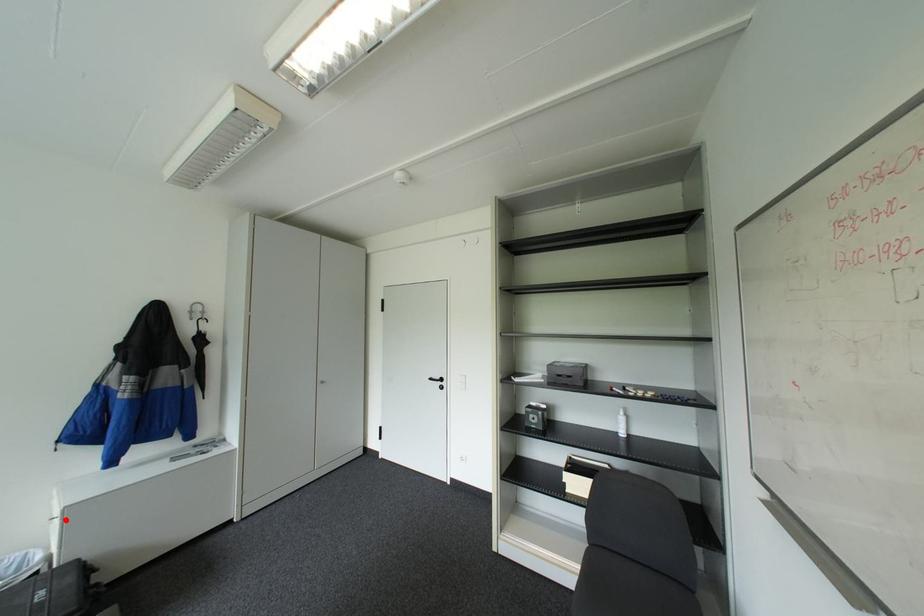
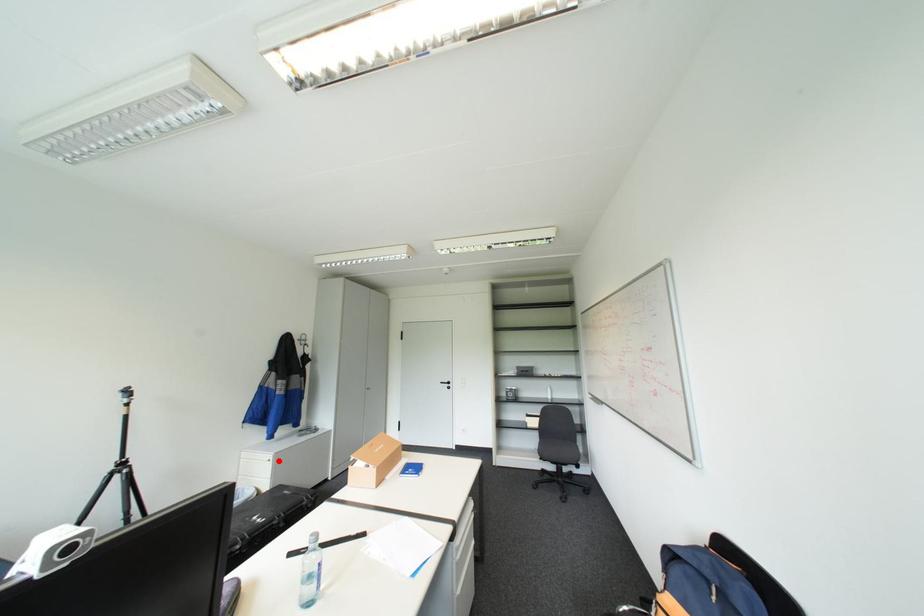
I am providing you with two images of the same scene from different viewpoints. A red point is marked on the first image and another point is marked on the second image. Does the point marked in image1 correspond to the same location as the one in image2?

Yes